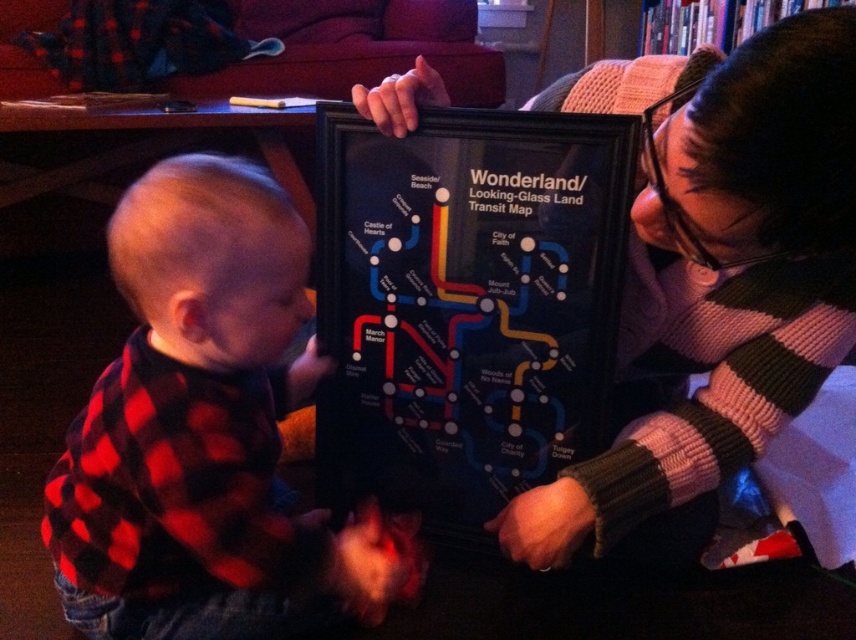
Question: Where is knitted sweater at center located in relation to red plaid shirt at left in the image?

Choices:
 (A) below
 (B) above

Answer: (B)

Question: Is knitted sweater at center above red plaid shirt at left?

Choices:
 (A) no
 (B) yes

Answer: (B)

Question: Is knitted sweater at center thinner than red plaid shirt at left?

Choices:
 (A) no
 (B) yes

Answer: (A)